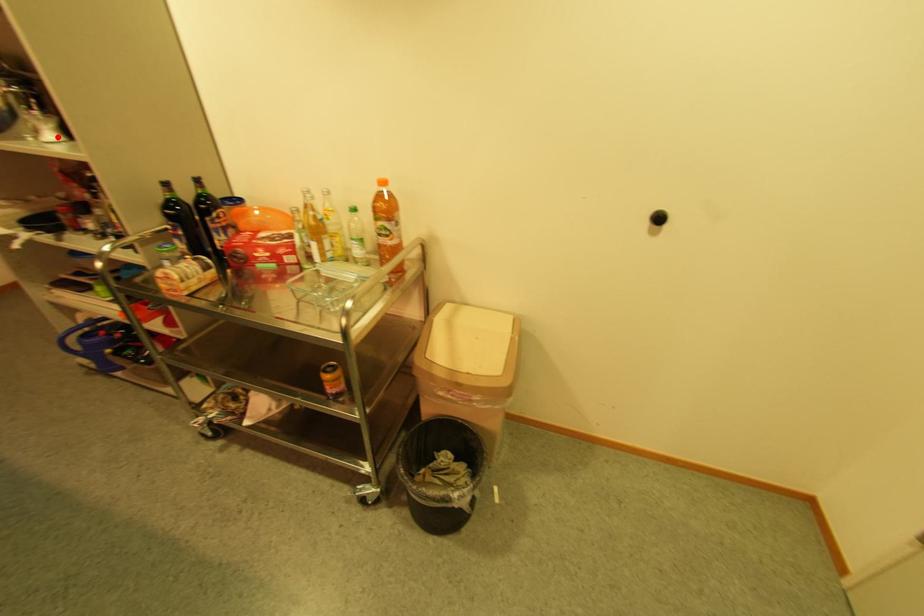
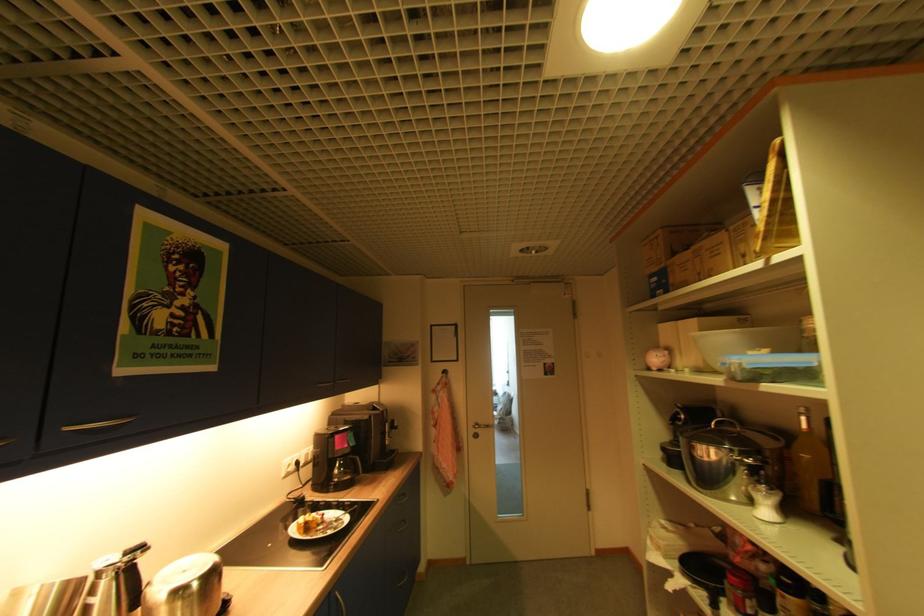
Question: I am providing you with two images of the same scene from different viewpoints. A red point is shown in image1. For the corresponding object point in image2, is it positioned nearer or farther from the camera?

Choices:
 (A) Nearer
 (B) Farther

Answer: (A)